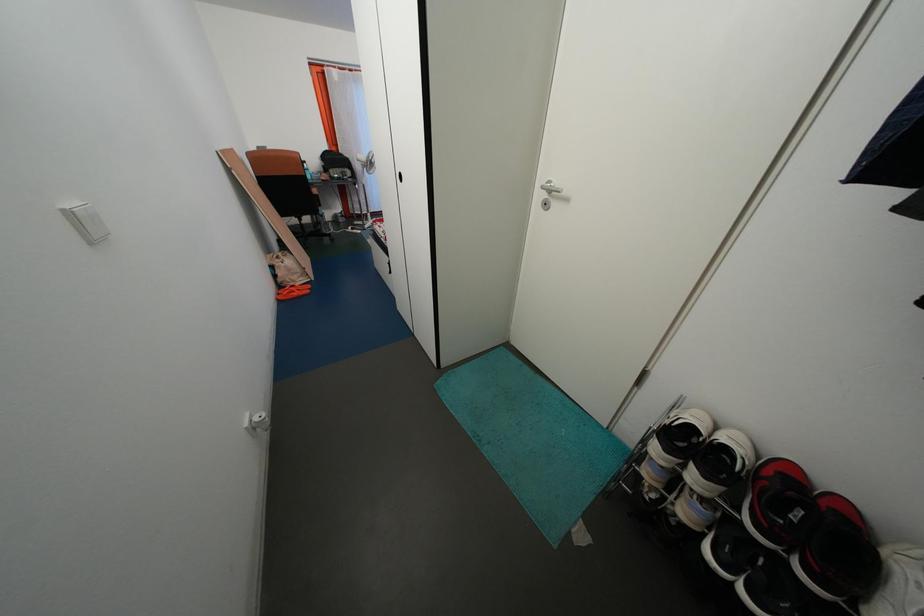
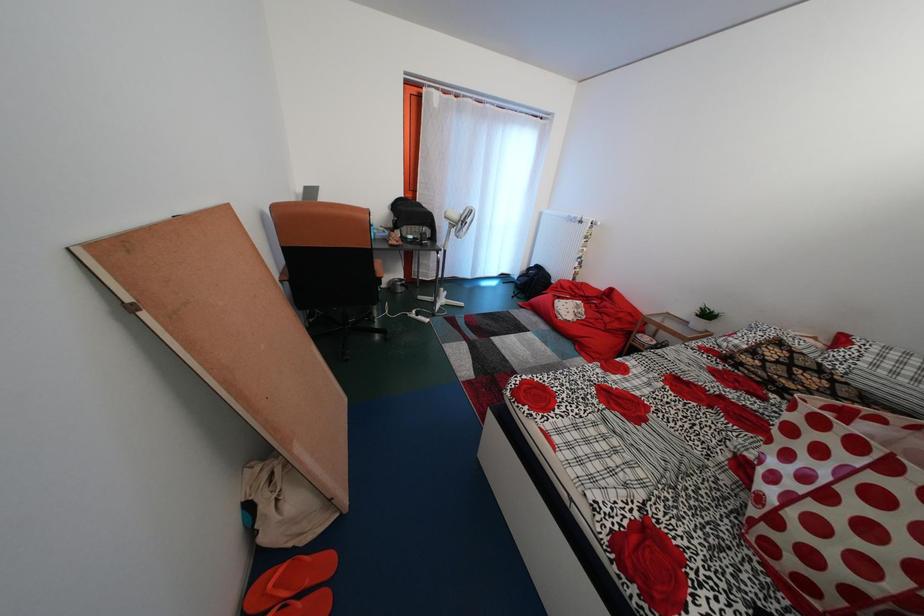
In a continuous first-person perspective shot, in which direction is the camera moving?

The cameraman walked toward left, forward.